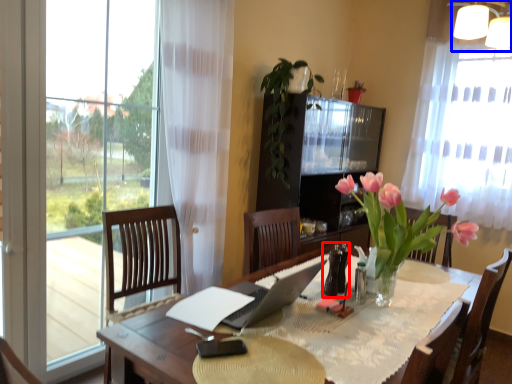
Question: Which object is further to the camera taking this photo, bottle (highlighted by a red box) or lamp (highlighted by a blue box)?

Choices:
 (A) bottle
 (B) lamp

Answer: (B)